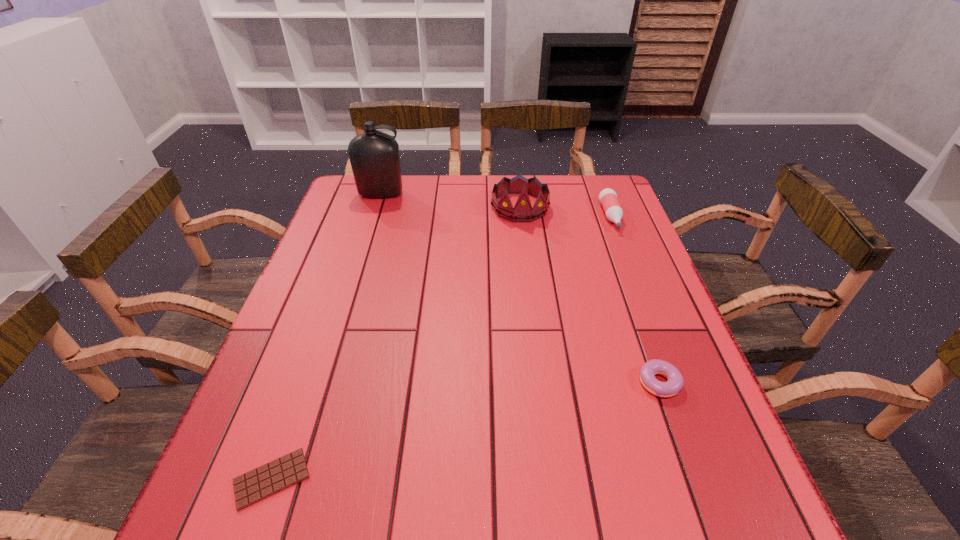
Where is `vacant space located on the front of the tallest object`? Image resolution: width=960 pixels, height=540 pixels. vacant space located on the front of the tallest object is located at coordinates (367, 241).

You are a GUI agent. You are given a task and a screenshot of the screen. Output one action in this format:
    pyautogui.click(x=<x>, y=<y>)
    Task: Click on the blank space located 0.090m at the front of the third object from left to right with jewels
    The image size is (960, 540).
    Given the screenshot: What is the action you would take?
    pyautogui.click(x=524, y=243)

Identify the location of vacant area situated 0.250m with the cap open on the shorter bottle. (641, 295).

Identify the location of free space located 0.350m on the left of the fourth farthest object. Image resolution: width=960 pixels, height=540 pixels. (464, 383).

You are a GUI agent. You are given a task and a screenshot of the screen. Output one action in this format:
    pyautogui.click(x=<x>, y=<y>)
    Task: Click on the free spot located 0.280m on the back of the candy bar
    This screenshot has height=540, width=960.
    Given the screenshot: What is the action you would take?
    pyautogui.click(x=324, y=330)

Where is `tiara situated at the far edge`? The image size is (960, 540). tiara situated at the far edge is located at coordinates (522, 212).

Image resolution: width=960 pixels, height=540 pixels. What are the coordinates of `object present at the near edge` in the screenshot? It's located at click(x=260, y=483).

At what (x,y) coordinates should I click in order to perform the action: click on bottle at the left edge. Please return your answer as a coordinate pair (x, y). The height and width of the screenshot is (540, 960). Looking at the image, I should click on (374, 156).

You are a GUI agent. You are given a task and a screenshot of the screen. Output one action in this format:
    pyautogui.click(x=<x>, y=<y>)
    Task: Click on the candy bar that is at the left edge
    The image size is (960, 540).
    Given the screenshot: What is the action you would take?
    [260, 483]

Identify the location of bottle that is at the right edge. (608, 198).